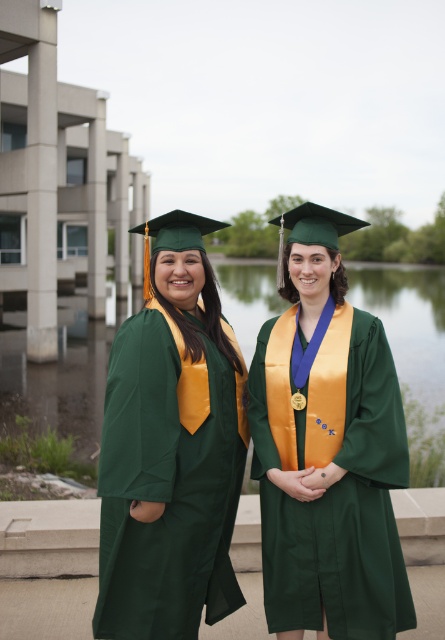
You are a photographer trying to capture a photo of the green matte graduation gown at left and the green fabric lake at center. Which object should you focus on first if you want to ensure both are in sharp focus?

The green matte graduation gown at left is shorter than the green fabric lake at center, so you should focus on the green fabric lake at center first to ensure both are in sharp focus.

You are a photographer taking a picture of the two points in the image. Which point is closer to the camera, point [268,435] or point [164,410]?

Point [268,435] is further to the viewer than point [164,410], so point [164,410] is closer to the camera.

Based on the photo, you are a photographer trying to capture a wide shot of the scene. Given that the green matte graduation gown at left and the green fabric lake at center are both in the frame, which object would require you to adjust your camera angle to include more of the scene due to its larger size?

The green fabric lake at center requires adjusting the camera angle because it has a greater width than the green matte graduation gown at left, making it take up more space in the frame.